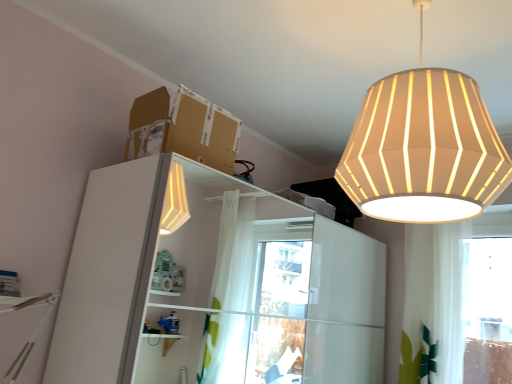
At what (x,y) coordinates should I click in order to perform the action: click on white glossy dresser at left. Please return your answer as a coordinate pair (x, y). Looking at the image, I should click on (214, 285).

I want to click on white fabric lampshade at upper right, so click(x=424, y=149).

Considering the relative positions of white fabric lampshade at upper right and white glossy dresser at left in the image provided, is white fabric lampshade at upper right to the right of white glossy dresser at left from the viewer's perspective?

Correct, you'll find white fabric lampshade at upper right to the right of white glossy dresser at left.

Can you see white fabric lampshade at upper right touching white glossy dresser at left?

No, white fabric lampshade at upper right is not touching white glossy dresser at left.

Is point (463, 94) closer to camera compared to point (209, 221)?

Yes, point (463, 94) is closer to viewer.

Which is correct: white fabric lampshade at upper right is inside white glossy dresser at left, or outside of it?

white fabric lampshade at upper right exists outside the volume of white glossy dresser at left.

Could you tell me if white glossy dresser at left is turned towards white fabric lampshade at upper right?

No, white glossy dresser at left is not facing towards white fabric lampshade at upper right.

Considering the relative positions of white glossy dresser at left and white fabric lampshade at upper right in the image provided, is white glossy dresser at left to the right of white fabric lampshade at upper right from the viewer's perspective?

Incorrect, white glossy dresser at left is not on the right side of white fabric lampshade at upper right.

From a real-world perspective, which is physically above, white glossy dresser at left or white fabric lampshade at upper right?

In real-world perspective, white fabric lampshade at upper right is above.

Can you confirm if white fabric lampshade at upper right is thinner than brown cardboard box at upper center?

In fact, white fabric lampshade at upper right might be wider than brown cardboard box at upper center.

Is white fabric lampshade at upper right oriented away from brown cardboard box at upper center?

That's not correct — white fabric lampshade at upper right is not looking away from brown cardboard box at upper center.

From the image's perspective, which is above, white fabric lampshade at upper right or brown cardboard box at upper center?

white fabric lampshade at upper right, from the image's perspective.

Does point (191, 148) come behind point (98, 380)?

Yes, point (191, 148) is farther from viewer.

The width and height of the screenshot is (512, 384). I want to click on dresser below the brown cardboard box at upper center (from a real-world perspective), so click(214, 285).

Considering the sizes of brown cardboard box at upper center and white glossy dresser at left in the image, is brown cardboard box at upper center taller or shorter than white glossy dresser at left?

Considering their sizes, brown cardboard box at upper center has less height than white glossy dresser at left.

Is brown cardboard box at upper center oriented towards white glossy dresser at left?

No, brown cardboard box at upper center is not aimed at white glossy dresser at left.

In terms of height, does white glossy dresser at left look taller or shorter compared to brown cardboard box at upper center?

white glossy dresser at left is taller than brown cardboard box at upper center.

From a real-world perspective, which is physically above, white glossy dresser at left or brown cardboard box at upper center?

brown cardboard box at upper center.

Can you confirm if white glossy dresser at left is positioned to the right of brown cardboard box at upper center?

Correct, you'll find white glossy dresser at left to the right of brown cardboard box at upper center.

From the image's perspective, does brown cardboard box at upper center appear higher than white fabric lampshade at upper right?

No, from the image's perspective, brown cardboard box at upper center is not above white fabric lampshade at upper right.

Considering the relative positions of brown cardboard box at upper center and white fabric lampshade at upper right in the image provided, is brown cardboard box at upper center behind white fabric lampshade at upper right?

Yes, the depth of brown cardboard box at upper center is greater than that of white fabric lampshade at upper right.

Considering the relative sizes of brown cardboard box at upper center and white fabric lampshade at upper right in the image provided, is brown cardboard box at upper center thinner than white fabric lampshade at upper right?

Indeed, brown cardboard box at upper center has a lesser width compared to white fabric lampshade at upper right.

Locate an element on the screen. dresser on the left side of white fabric lampshade at upper right is located at coordinates (214, 285).

You are a GUI agent. You are given a task and a screenshot of the screen. Output one action in this format:
    pyautogui.click(x=<x>, y=<y>)
    Task: Click on the lamp in front of the white glossy dresser at left
    
    Given the screenshot: What is the action you would take?
    pyautogui.click(x=424, y=149)

Looking at the image, which one is located closer to white fabric lampshade at upper right, brown cardboard box at upper center or white glossy dresser at left?

brown cardboard box at upper center is positioned closer to the anchor white fabric lampshade at upper right.

When comparing their distances from brown cardboard box at upper center, does white fabric lampshade at upper right or white glossy dresser at left seem further?

white glossy dresser at left.

Based on their spatial positions, is white fabric lampshade at upper right or brown cardboard box at upper center further from white glossy dresser at left?

white fabric lampshade at upper right is further to white glossy dresser at left.

Considering their positions, is white glossy dresser at left positioned closer to white fabric lampshade at upper right than brown cardboard box at upper center?

Among the two, brown cardboard box at upper center is located nearer to white fabric lampshade at upper right.

From the image, which object appears to be nearer to brown cardboard box at upper center, white glossy dresser at left or white fabric lampshade at upper right?

white fabric lampshade at upper right lies closer to brown cardboard box at upper center than the other object.

Which object lies nearer to the anchor point white glossy dresser at left, brown cardboard box at upper center or white fabric lampshade at upper right?

The object closer to white glossy dresser at left is brown cardboard box at upper center.

Locate an element on the screen. cardboard box between white fabric lampshade at upper right and white glossy dresser at left in the vertical direction is located at coordinates (203, 131).